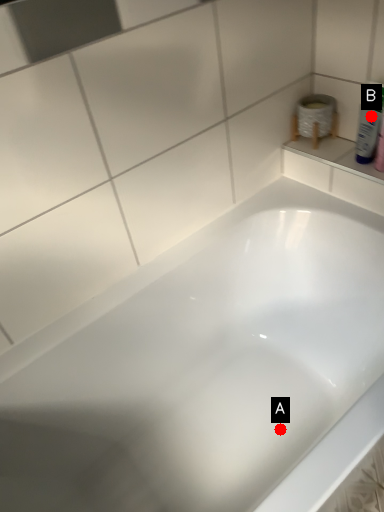
Question: Two points are circled on the image, labeled by A and B beside each circle. Which of the following is the farthest from the observer?

Choices:
 (A) A is further
 (B) B is further

Answer: (A)